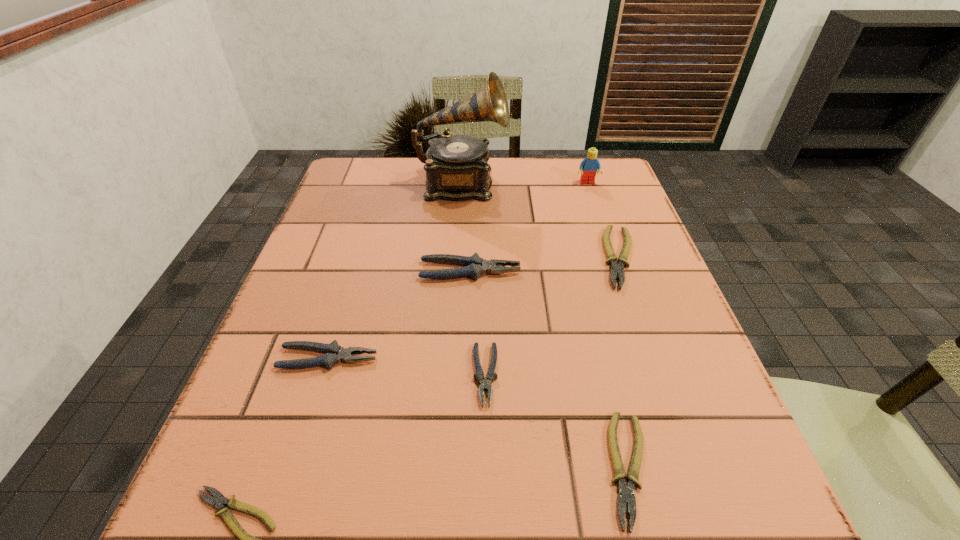
You are a GUI agent. You are given a task and a screenshot of the screen. Output one action in this format:
    pyautogui.click(x=<x>, y=<y>)
    Task: Click on the free region at the near right corner of the desktop
    This screenshot has height=540, width=960.
    Given the screenshot: What is the action you would take?
    pyautogui.click(x=692, y=539)

This screenshot has height=540, width=960. What are the coordinates of `empty space between the seventh tallest object and the sixth shortest object` in the screenshot? It's located at (549, 370).

You are a GUI agent. You are given a task and a screenshot of the screen. Output one action in this format:
    pyautogui.click(x=<x>, y=<y>)
    Task: Click on the vacant region between the leftmost gray pliers and the second shortest object
    
    Given the screenshot: What is the action you would take?
    pyautogui.click(x=479, y=414)

Identify the location of vacant area between the tallest pliers and the smallest gray pliers. Image resolution: width=960 pixels, height=540 pixels. (478, 323).

You are a GUI agent. You are given a task and a screenshot of the screen. Output one action in this format:
    pyautogui.click(x=<x>, y=<y>)
    Task: Click on the free space between the second shortest object and the sixth shortest object
    The image size is (960, 540).
    Given the screenshot: What is the action you would take?
    pyautogui.click(x=549, y=370)

Image resolution: width=960 pixels, height=540 pixels. Find the location of `vacant space that is in between the second tallest pliers and the smallest gray pliers`. vacant space that is in between the second tallest pliers and the smallest gray pliers is located at coordinates (407, 367).

I want to click on vacant point located between the tallest pliers and the farthest yellow pliers, so click(x=545, y=264).

You are a GUI agent. You are given a task and a screenshot of the screen. Output one action in this format:
    pyautogui.click(x=<x>, y=<y>)
    Task: Click on the free area in between the smallest gray pliers and the second pliers from right to left
    The height and width of the screenshot is (540, 960).
    Given the screenshot: What is the action you would take?
    pyautogui.click(x=557, y=422)

This screenshot has width=960, height=540. What are the coordinates of `free space between the second biggest yellow pliers and the rightmost yellow pliers` in the screenshot? It's located at (624, 363).

This screenshot has height=540, width=960. I want to click on object that stands as the fourth closest to the biggest yellow pliers, so click(x=486, y=383).